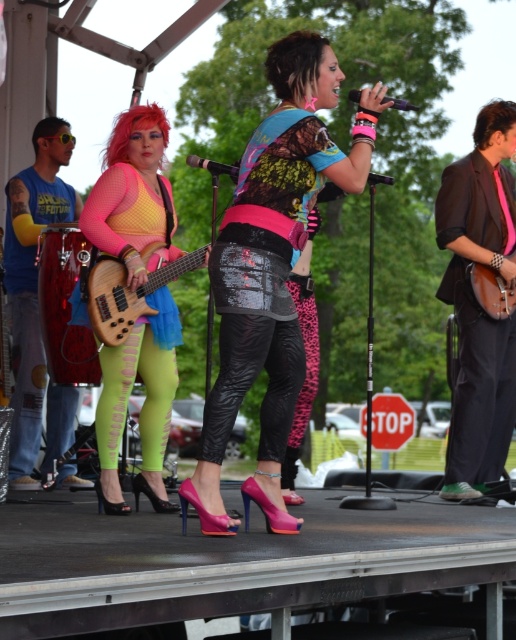
You are a stagehand who needs to move the shiny brown guitar at right and the wooden acoustic guitar at right to the left side of the stage. The stage is narrow, and you can only move one guitar at a time. Which guitar should you move first to ensure there is enough space for both guitars on the left side?

You should move the wooden acoustic guitar at right first because the shiny brown guitar at right is 11.91 inches away from it. By moving the wooden acoustic guitar first, you can position it on the left side, leaving enough space for the shiny brown guitar to be placed next without overcrowding the area.

You are a photographer trying to capture the band members on stage. You notice the shiny sequined skirt at center and the shiny brown guitar at right. Which object is wider?

The shiny sequined skirt at center is wider than the shiny brown guitar at right.

You are a stagehand who needs to move the brushed metal drum at left and the wooden bass guitar at center closer together by 2 feet. How far apart will they be after you move them?

The current distance between the brushed metal drum at left and the wooden bass guitar at center is 4.76 feet. If you move them closer by 2 feet, the new distance will be 4.76 minus 2, which equals 2.76 feet apart.